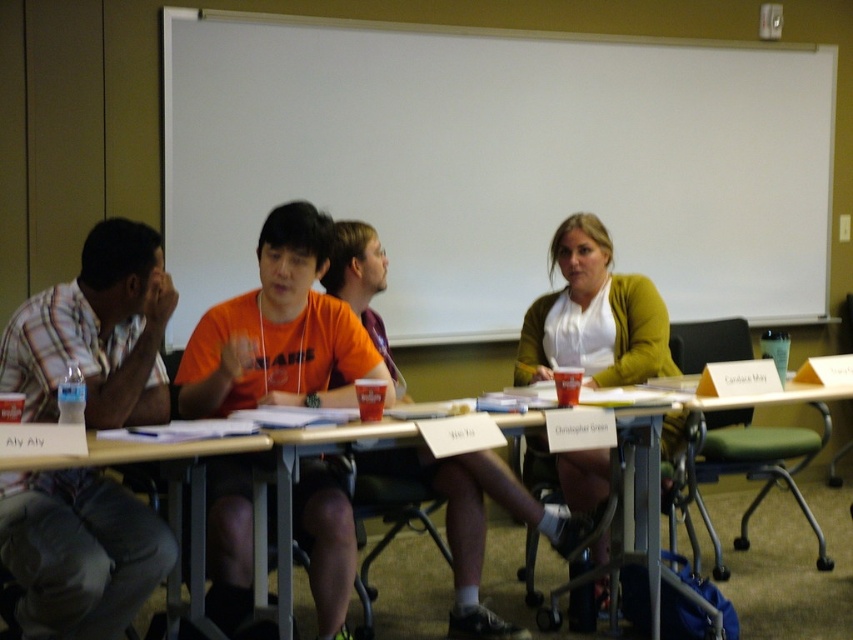
Does white matte board at upper center have a lesser width compared to wooden table at lower left?

No, white matte board at upper center is not thinner than wooden table at lower left.

Is white matte board at upper center to the left of wooden table at lower left from the viewer's perspective?

Incorrect, white matte board at upper center is not on the left side of wooden table at lower left.

Find the location of a particular element. white matte board at upper center is located at coordinates (498, 163).

The width and height of the screenshot is (853, 640). Describe the element at coordinates (97, 332) in the screenshot. I see `plaid shirt at left` at that location.

Which of these two, plaid shirt at left or wooden table at lower left, stands taller?

With more height is plaid shirt at left.

Is point (91, 362) positioned before point (177, 576)?

Yes, point (91, 362) is closer to viewer.

You are a GUI agent. You are given a task and a screenshot of the screen. Output one action in this format:
    pyautogui.click(x=<x>, y=<y>)
    Task: Click on the plaid shirt at left
    Image resolution: width=853 pixels, height=640 pixels.
    Given the screenshot: What is the action you would take?
    pyautogui.click(x=97, y=332)

Who is positioned more to the right, plaid shirt at left or orange cotton shirt at center?

Positioned to the right is orange cotton shirt at center.

Is plaid shirt at left to the right of orange cotton shirt at center from the viewer's perspective?

Incorrect, plaid shirt at left is not on the right side of orange cotton shirt at center.

Does point (88, 340) lie in front of point (471, 612)?

Yes, point (88, 340) is closer to viewer.

This screenshot has height=640, width=853. Find the location of `plaid shirt at left`. plaid shirt at left is located at coordinates (97, 332).